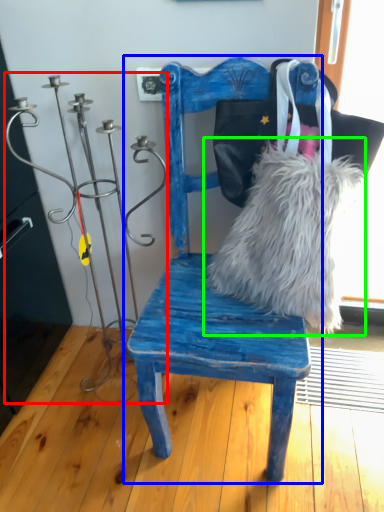
Question: Which object is the closest to the candle holder (highlighted by a red box)? Choose among these: chair (highlighted by a blue box) or fur (highlighted by a green box).

Choices:
 (A) chair
 (B) fur

Answer: (A)